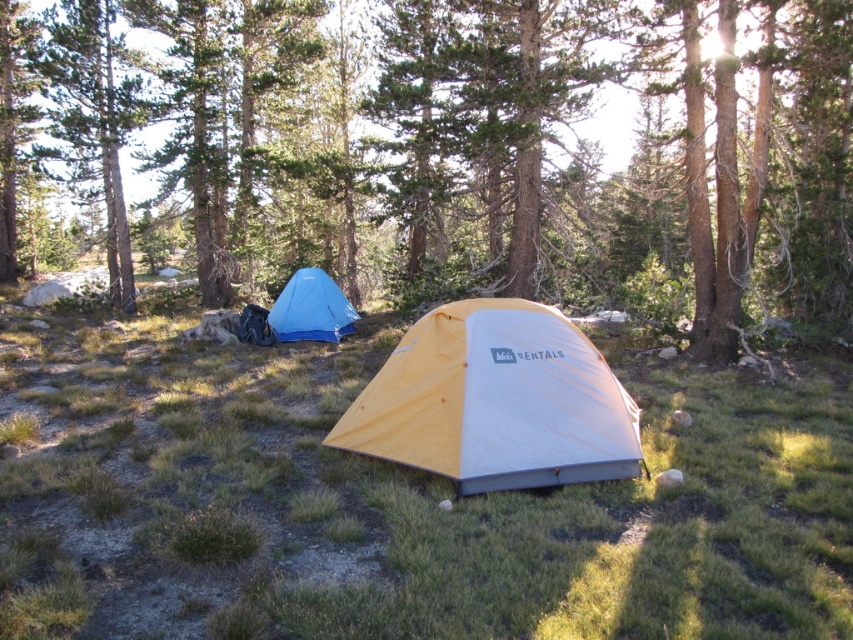
Is brown textured tree at center taller than yellow fabric tent at center?

Yes, brown textured tree at center is taller than yellow fabric tent at center.

Is point (291, 156) behind point (593, 458)?

That is True.

Is point (260, 298) positioned behind point (433, 435)?

Yes, it is behind point (433, 435).

Identify the location of brown textured tree at center. (451, 148).

Does green grass at center have a greater height compared to blue tarp at center?

No, green grass at center is not taller than blue tarp at center.

Between green grass at center and blue tarp at center, which one appears on the left side from the viewer's perspective?

blue tarp at center

This screenshot has width=853, height=640. What do you see at coordinates (396, 502) in the screenshot?
I see `green grass at center` at bounding box center [396, 502].

Image resolution: width=853 pixels, height=640 pixels. I want to click on green grass at center, so click(396, 502).

Is point (186, 604) in front of point (540, 385)?

Yes, it is in front of point (540, 385).

Is point (740, 531) less distant than point (392, 394)?

Yes.

I want to click on green grass at center, so click(x=396, y=502).